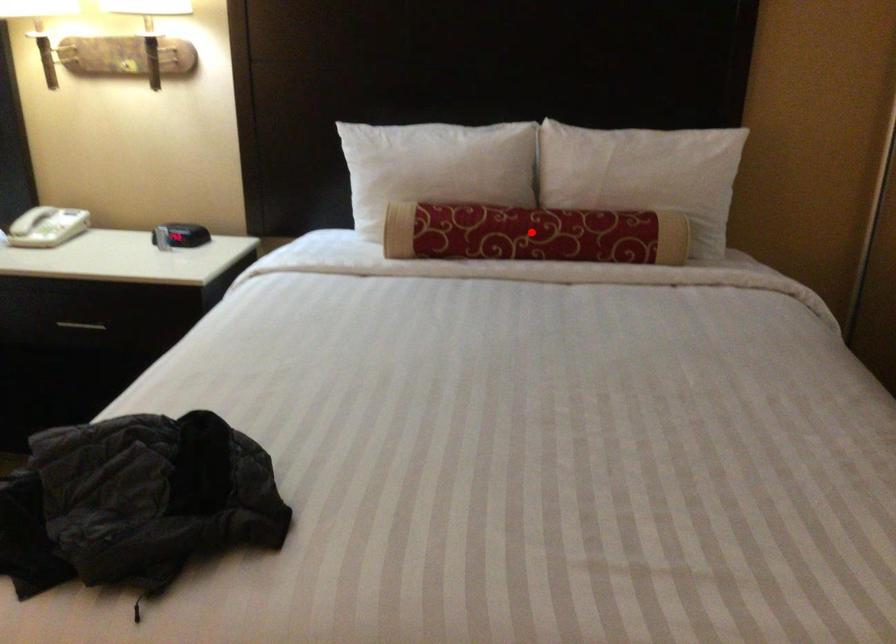
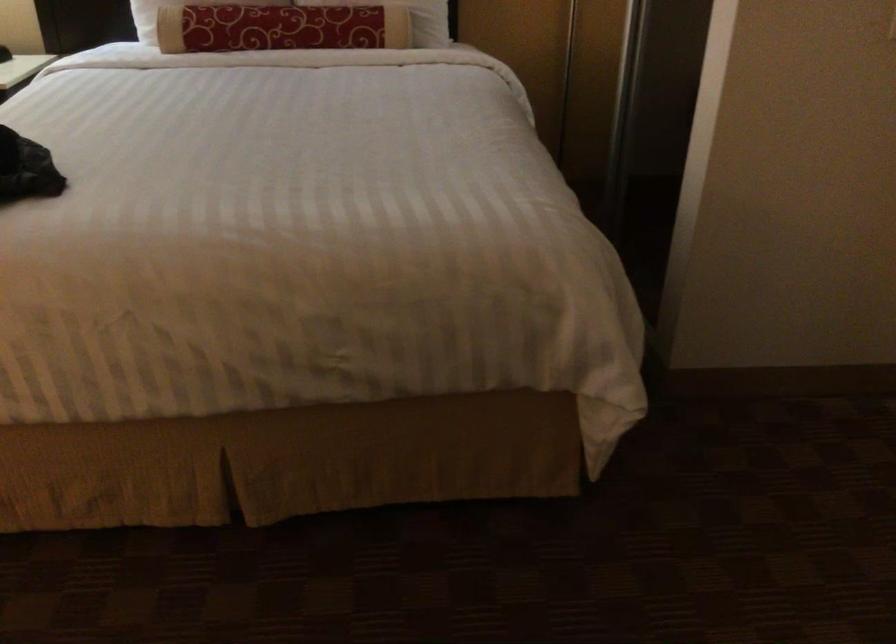
Question: A red point is marked in image1. In image2, is the corresponding 3D point closer to the camera or farther? Reply with the corresponding letter.

Choices:
 (A) The corresponding 3D point is closer.
 (B) The corresponding 3D point is farther.

Answer: (B)